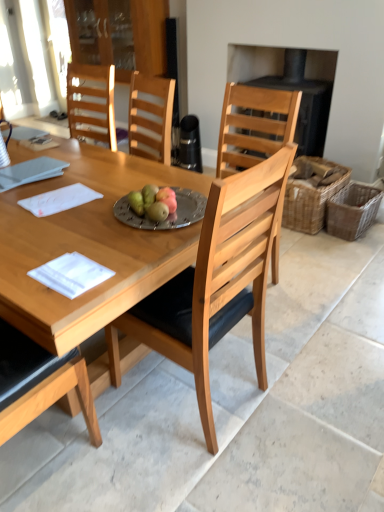
Where is `free space in front of woven brown picnic basket at right, which ranks as the first picnic basket in left-to-right order`? The image size is (384, 512). free space in front of woven brown picnic basket at right, which ranks as the first picnic basket in left-to-right order is located at coordinates (319, 248).